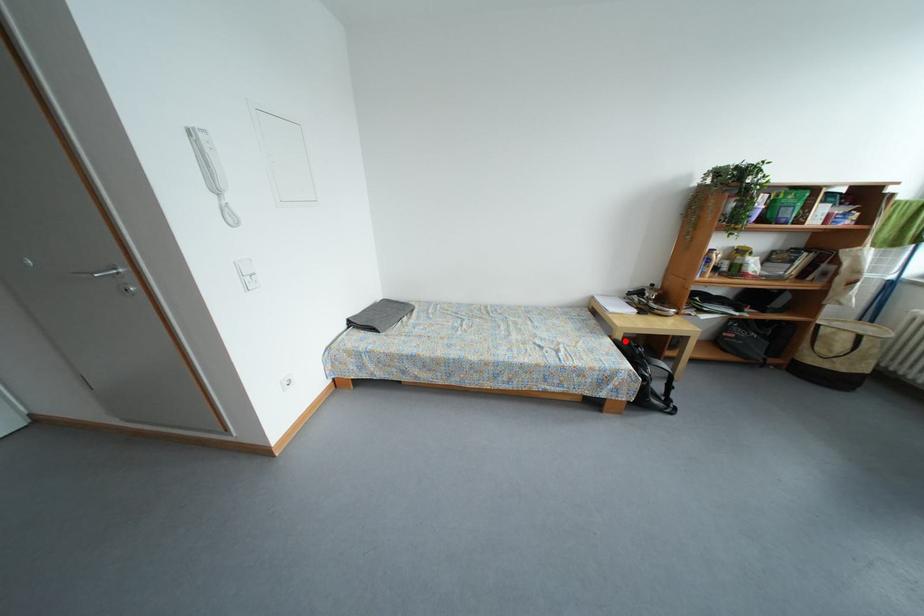
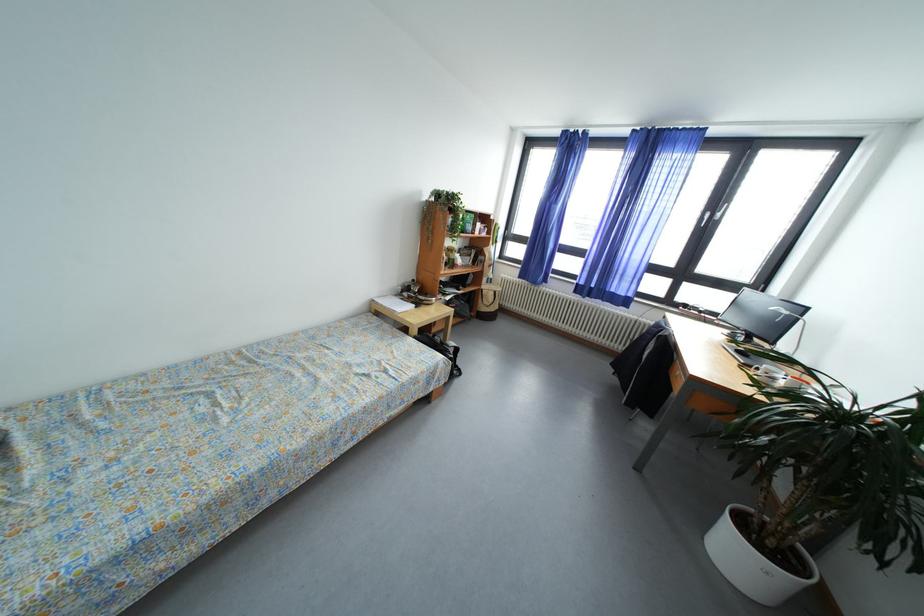
Question: I am providing you with two images of the same scene from different viewpoints. Image1 has a red point marked. In image2, the corresponding 3D location appears at what relative position? Reply with the corresponding letter.

Choices:
 (A) Closer
 (B) Farther

Answer: (A)